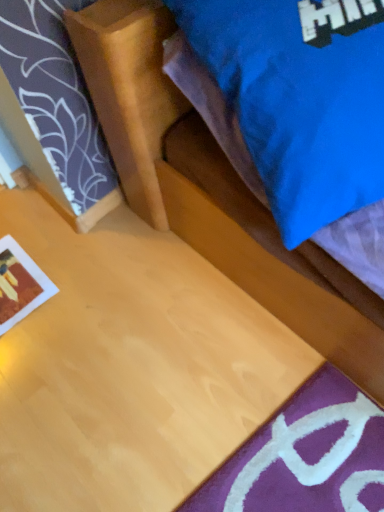
The height and width of the screenshot is (512, 384). I want to click on free location to the right of matte paper print at lower left, so click(85, 304).